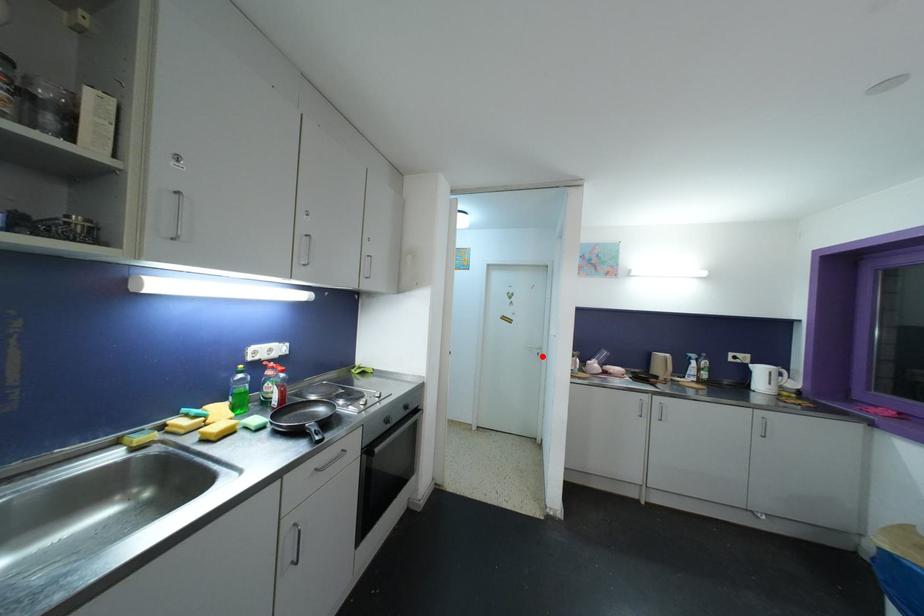
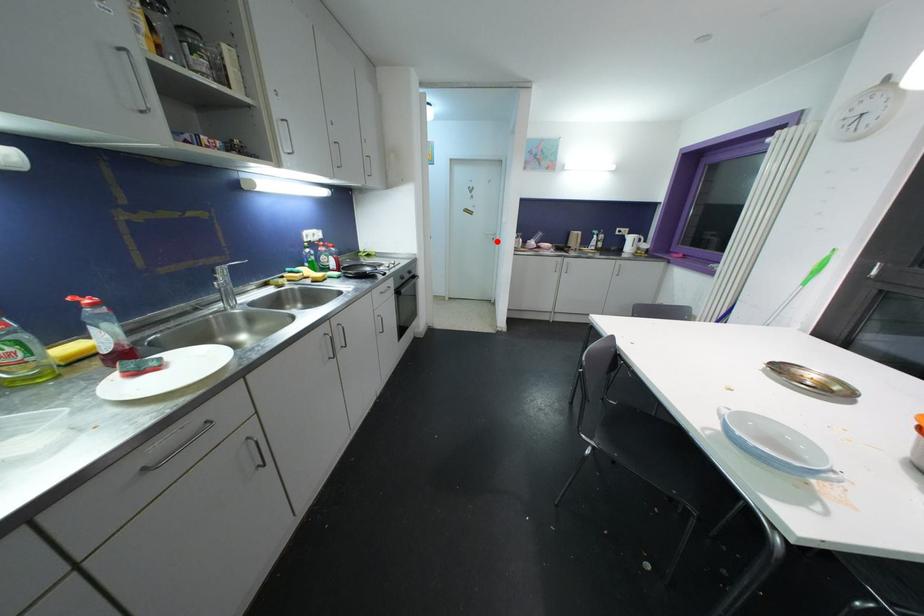
In the scene shown: I am providing you with two images of the same scene from different viewpoints. A red point is marked on the first image and another point is marked on the second image. Is the marked point in image1 the same physical position as the marked point in image2?

Yes